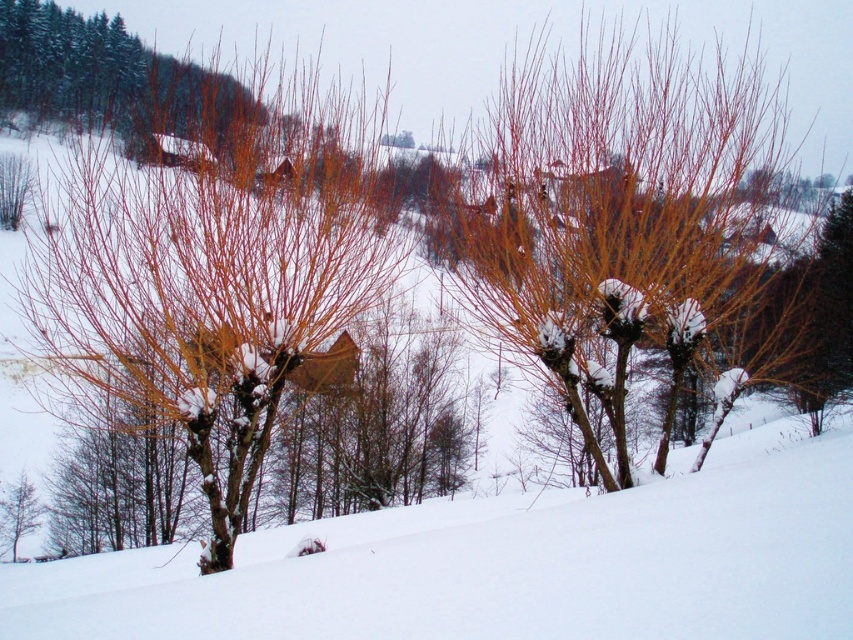
You are an arborist assessing the trees in the winter landscape. You need to determine which object has a greater width between the smooth orange branches at center and the green matte tree at lower left. Based on the scene, can you identify which one is wider?

The smooth orange branches at center might be wider than green matte tree at lower left according to the description.

You are standing at a point in the winter landscape and want to walk towards the point that is further away. Which point should you head to, point (508, 296) or point (15, 560)?

You should head to point (15, 560) because point (508, 296) is in front of point (15, 560), meaning point (15, 560) is further away.

In the scene shown: You are an arborist examining the winter landscape. You notice a point marked at coordinates (x=630, y=225). Which tree does this point correspond to?

The point at (x=630, y=225) corresponds to the smooth bark tree at center.